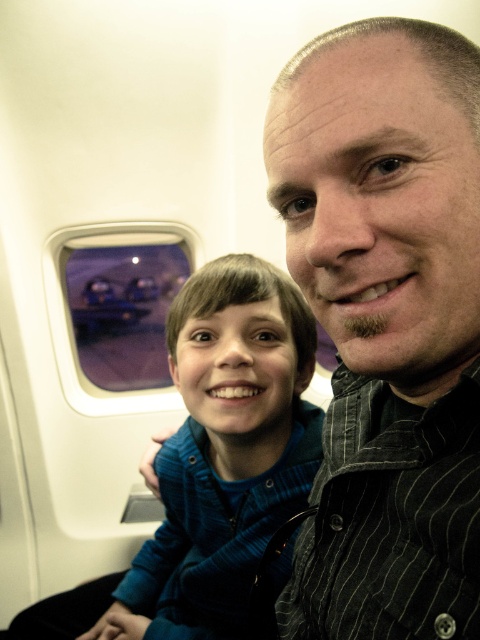
You are a flight attendant observing the passengers in the airplane cabin. You notice the black striped shirt at upper right and the blue striped shirt at center. Which shirt is smaller in size?

The black striped shirt at upper right is smaller than the blue striped shirt at center according to the description.

You are a flight attendant standing at the back of the airplane cabin. You need to move from your current position to the transparent glass airplane window at upper left to assist a passenger. However, there is a black striped shirt at upper right blocking your path. Can you walk straight to the window without going around?

The black striped shirt at upper right is 3.02 meters away from the transparent glass airplane window at upper left. Since the shirt is an article of clothing and not an actual obstacle, you can walk straight to the window without any obstruction.

You are a passenger sitting in the airplane cabin. You notice the blue striped shirt at center and the transparent glass airplane window at upper left. Which object is nearer to you?

The blue striped shirt at center is closer to the viewer than the transparent glass airplane window at upper left.